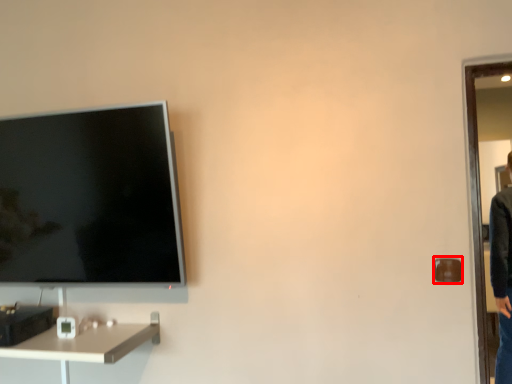
Question: From the image's perspective, what is the correct spatial relationship of door handle (annotated by the red box) in relation to desk?

Choices:
 (A) below
 (B) above

Answer: (B)